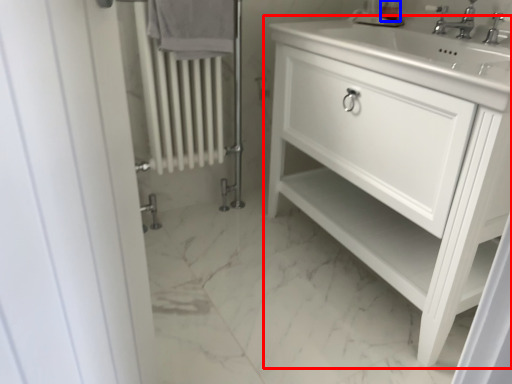
Question: Among these objects, which one is nearest to the camera, bathroom cabinet (highlighted by a red box) or soap dispenser (highlighted by a blue box)?

Choices:
 (A) bathroom cabinet
 (B) soap dispenser

Answer: (A)